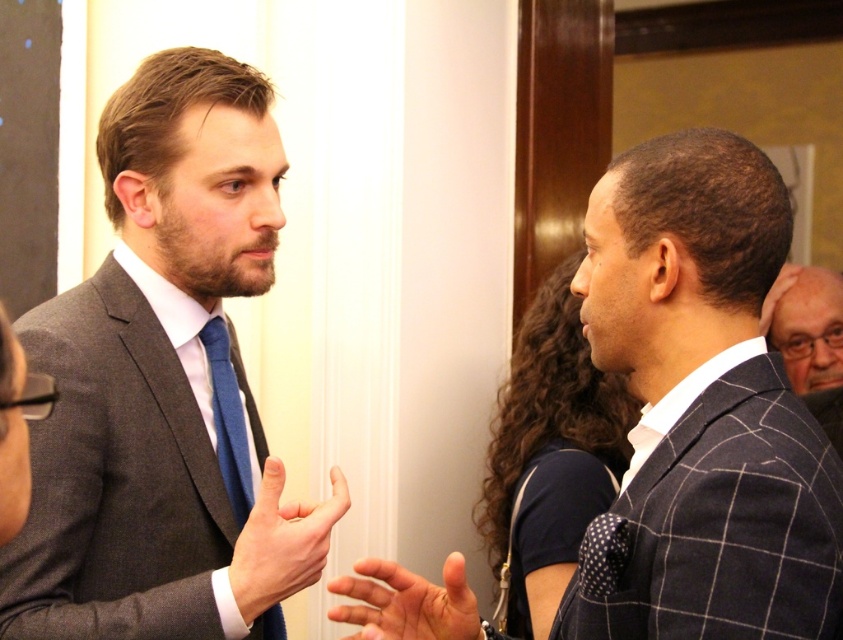
Question: Does matte black suit at right come in front of blue silk tie at center?

Choices:
 (A) no
 (B) yes

Answer: (A)

Question: Which point is closer to the camera?

Choices:
 (A) matte gray suit at center
 (B) dark blue checkered suit at right

Answer: (B)

Question: Is dark blue checkered suit at right smaller than matte black suit at right?

Choices:
 (A) yes
 (B) no

Answer: (B)

Question: Which object appears closest to the camera in this image?

Choices:
 (A) blue silk tie at center
 (B) dark blue checkered suit at right
 (C) matte black suit at right
 (D) matte gray suit at center

Answer: (B)

Question: Based on their relative distances, which object is farther from the dark blue checkered suit at right?

Choices:
 (A) blue silk tie at center
 (B) matte gray suit at center

Answer: (A)

Question: Does dark blue checkered suit at right have a lesser width compared to blue silk tie at center?

Choices:
 (A) no
 (B) yes

Answer: (A)